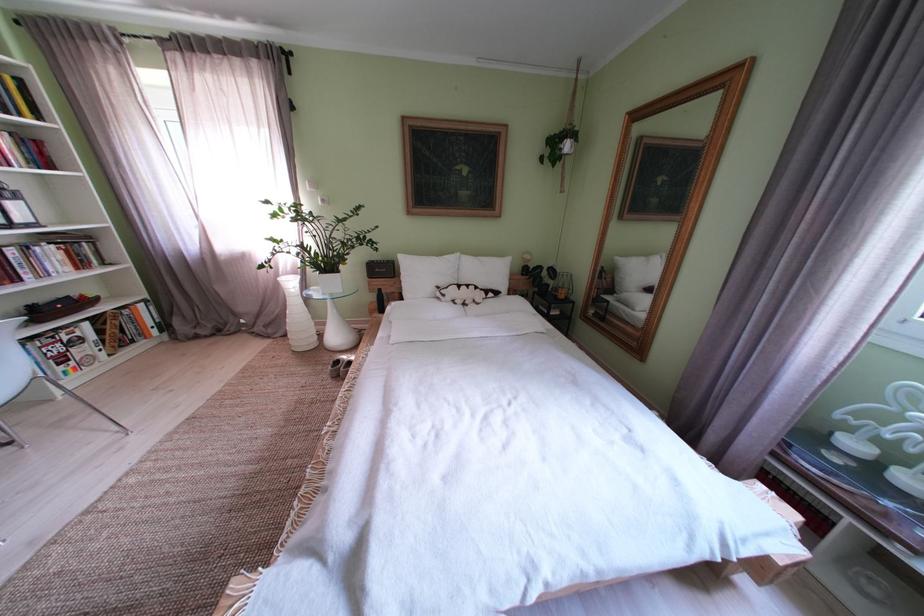
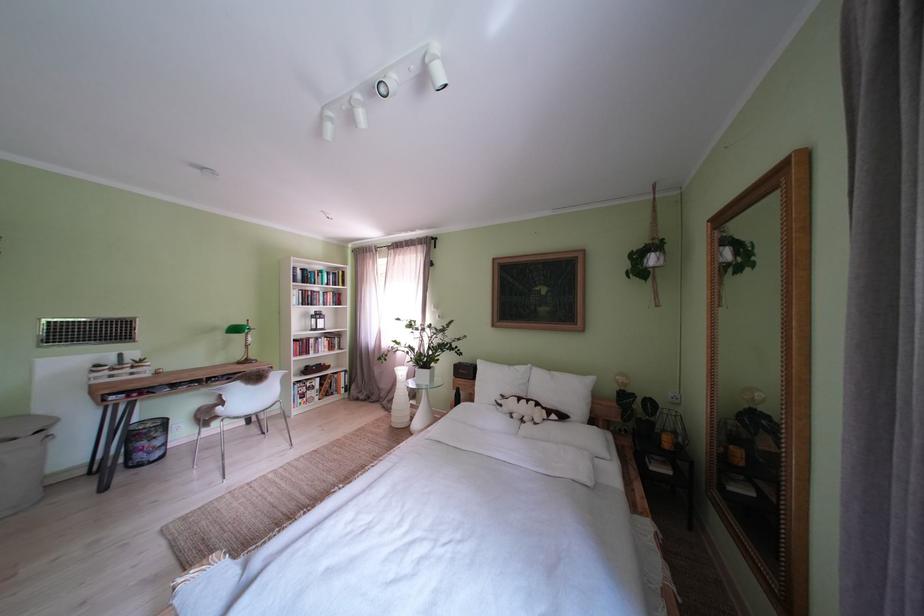
The point at (429, 280) is marked in the first image. Where is the corresponding point in the second image?

(500, 386)